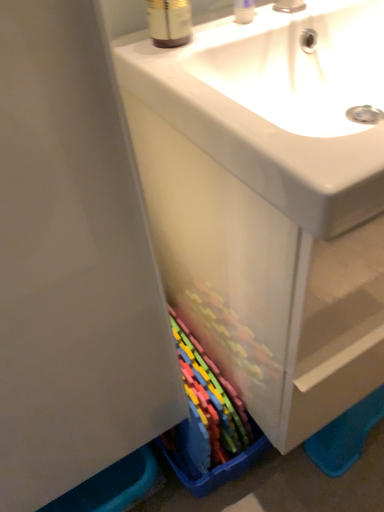
Question: Which is correct: brown plastic bottle at upper center is inside matte plastic cabinet at center, or outside of it?

Choices:
 (A) inside
 (B) outside

Answer: (B)

Question: From the image's perspective, is brown plastic bottle at upper center above or below matte plastic cabinet at center?

Choices:
 (A) above
 (B) below

Answer: (A)

Question: Estimate the real-world distances between objects in this image. Which object is farther from the matte plastic cabinet at center?

Choices:
 (A) clear plastic container at upper center
 (B) brown plastic bottle at upper center

Answer: (A)

Question: Which of these objects is positioned farthest from the matte plastic cabinet at center?

Choices:
 (A) clear plastic container at upper center
 (B) brown plastic bottle at upper center

Answer: (A)